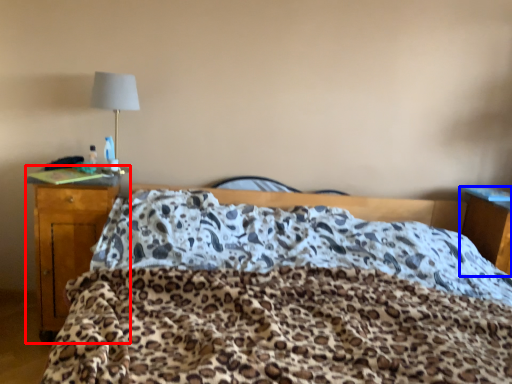
Question: Which object is further to the camera taking this photo, desk (highlighted by a red box) or nightstand (highlighted by a blue box)?

Choices:
 (A) desk
 (B) nightstand

Answer: (B)